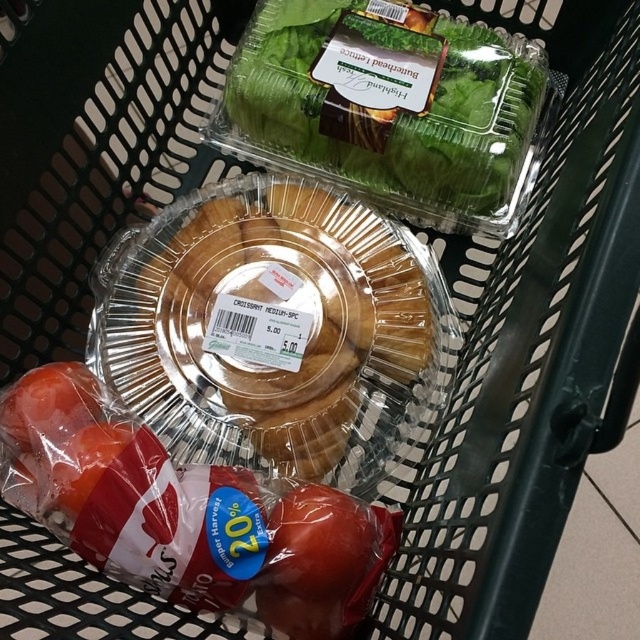
Which of these two, clear plastic pie at center or green leafy lettuce at upper center, stands taller?

clear plastic pie at center

Which is in front, point (236, 179) or point (435, 22)?

Positioned in front is point (236, 179).

Who is more forward, (250, 298) or (340, 148)?

Point (250, 298)

I want to click on clear plastic pie at center, so click(280, 308).